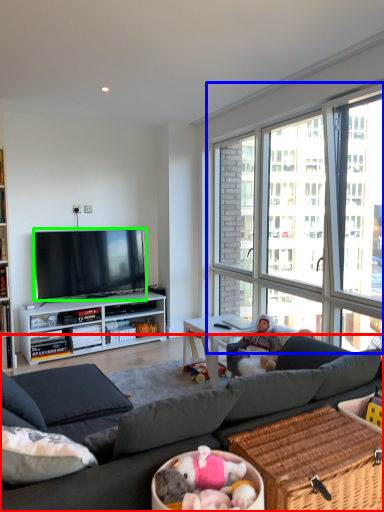
Question: Which object is positioned closest to studio couch (highlighted by a red box)? Select from window (highlighted by a blue box) and television (highlighted by a green box).

Choices:
 (A) window
 (B) television

Answer: (B)